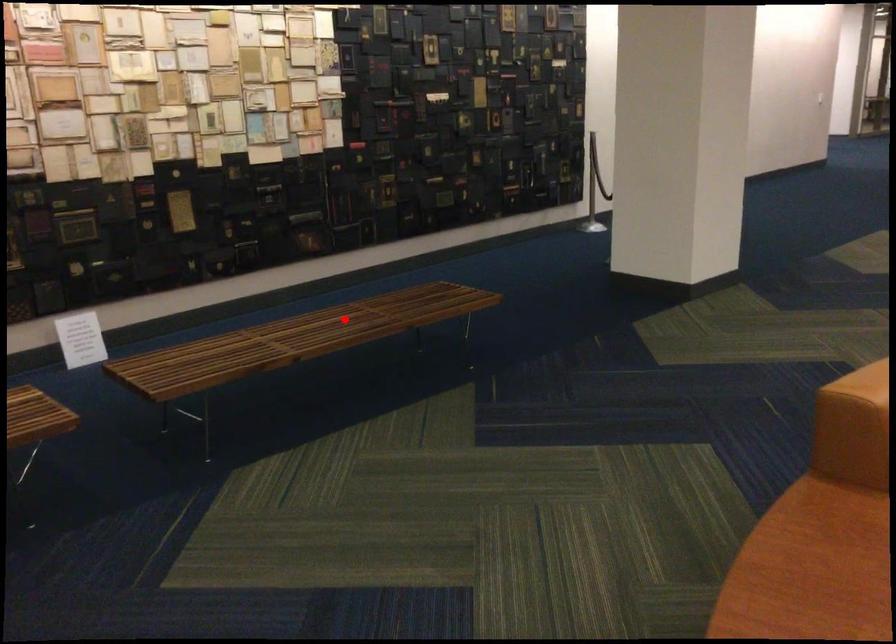
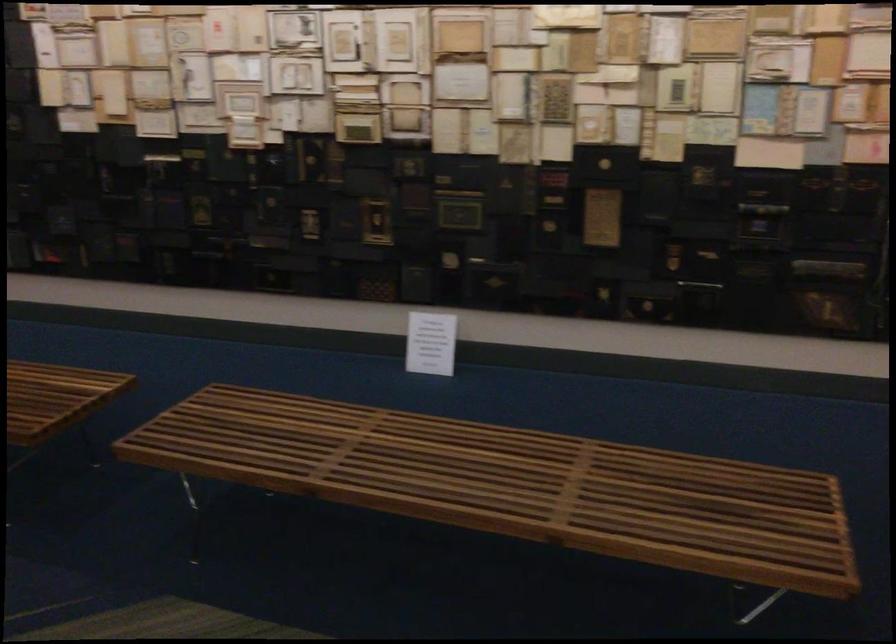
Question: I am providing you with two images of the same scene from different viewpoints. A red point is shown in image1. For the corresponding object point in image2, is it positioned nearer or farther from the camera?

Choices:
 (A) Nearer
 (B) Farther

Answer: (A)